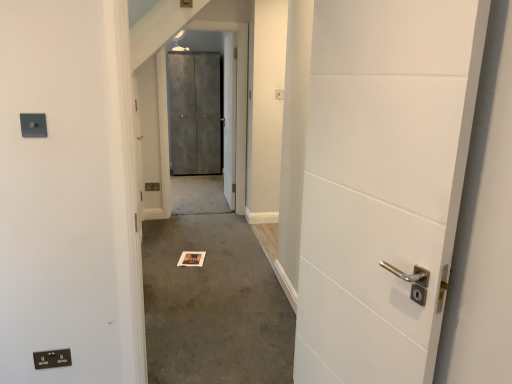
Question: Would you say matte gray electric outlet at upper left, arranged as the 2th electric outlet when ordered from the bottom, is to the left or to the right of carpeted floor at center in the picture?

Choices:
 (A) left
 (B) right

Answer: (A)

Question: Do you think matte gray electric outlet at upper left, which is the 1th electric outlet from top to bottom, is within carpeted floor at center, or outside of it?

Choices:
 (A) outside
 (B) inside

Answer: (A)

Question: Estimate the real-world distances between objects in this image. Which object is farther from the black plastic electric outlet at lower left, which ranks as the 2th electric outlet in front-to-back order?

Choices:
 (A) matte gray electric outlet at upper left, arranged as the 2th electric outlet when ordered from the bottom
 (B) carpeted floor at center
 (C) metallic gray elevator door at center

Answer: (C)

Question: Estimate the real-world distances between objects in this image. Which object is closer to the matte gray electric outlet at upper left, the 1th electric outlet positioned from the front?

Choices:
 (A) metallic gray elevator door at center
 (B) carpeted floor at center
 (C) black plastic electric outlet at lower left, which ranks as the 2th electric outlet in front-to-back order

Answer: (C)